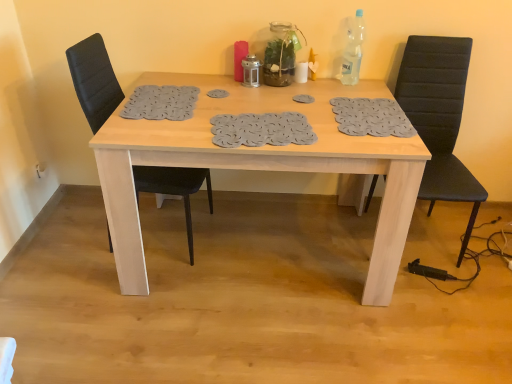
Where is `free space in front of black leather chair at left, the second chair from the right`? The height and width of the screenshot is (384, 512). free space in front of black leather chair at left, the second chair from the right is located at coordinates (126, 308).